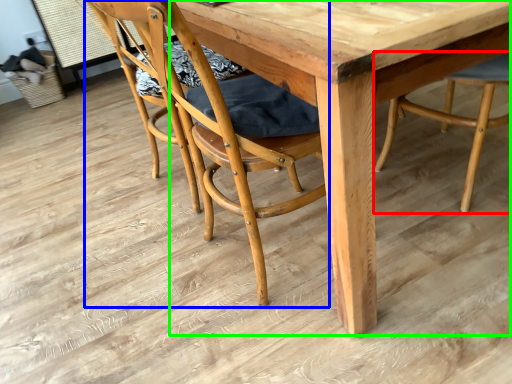
Question: Which object is positioned closest to chair (highlighted by a red box)? Select from chair (highlighted by a blue box) and round table (highlighted by a green box).

Choices:
 (A) chair
 (B) round table

Answer: (B)